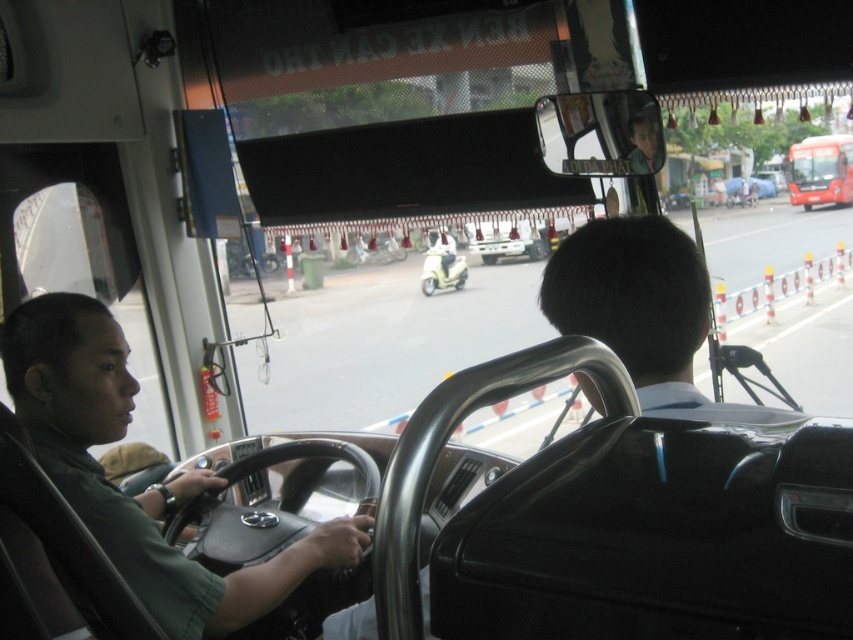
Question: Does green matte shirt at left appear on the right side of red glossy bus at upper right?

Choices:
 (A) yes
 (B) no

Answer: (B)

Question: Which of the following is the farthest from the observer?

Choices:
 (A) (804, 205)
 (B) (347, 557)

Answer: (A)

Question: Which point is closer to the camera?

Choices:
 (A) (851, 156)
 (B) (57, 380)

Answer: (B)

Question: Among these points, which one is farthest from the camera?

Choices:
 (A) (21, 381)
 (B) (811, 166)

Answer: (B)

Question: Does green matte shirt at left have a smaller size compared to red glossy bus at upper right?

Choices:
 (A) yes
 (B) no

Answer: (A)

Question: Is green matte shirt at left above red glossy bus at upper right?

Choices:
 (A) yes
 (B) no

Answer: (B)